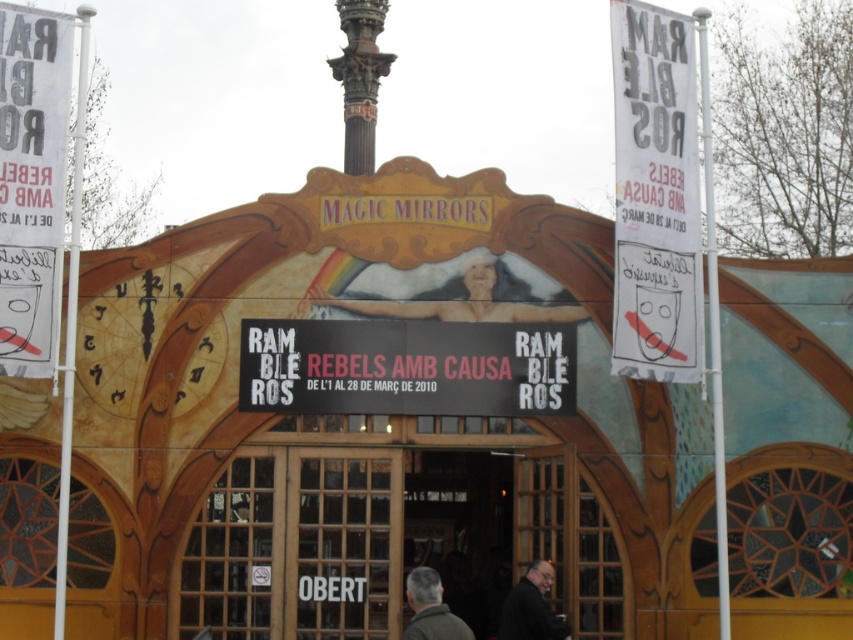
You are a visitor standing at the entrance of Magic Mirrors. You notice the white paper banner at upper right and the black matte sign at center. How far apart are these two objects?

The white paper banner at upper right and the black matte sign at center are 10.22 meters apart from each other.

You are a visitor at the entrance of Magic Mirrors venue. You see a smooth skin figure at center and a dark gray suit at lower center. Which object is taller?

The smooth skin figure at center is much taller than the dark gray suit at lower center.